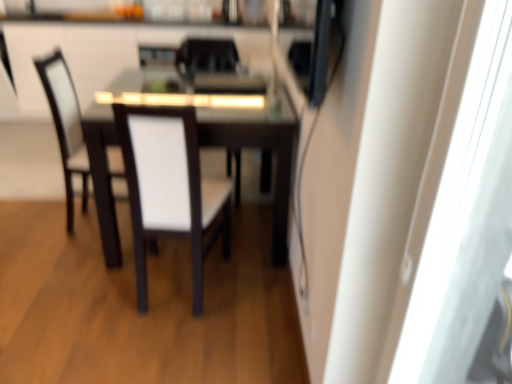
You are a GUI agent. You are given a task and a screenshot of the screen. Output one action in this format:
    pyautogui.click(x=<x>, y=<y>)
    Task: Click on the unoccupied area in front of dark wood table at center
    The width and height of the screenshot is (512, 384).
    Given the screenshot: What is the action you would take?
    pyautogui.click(x=155, y=318)